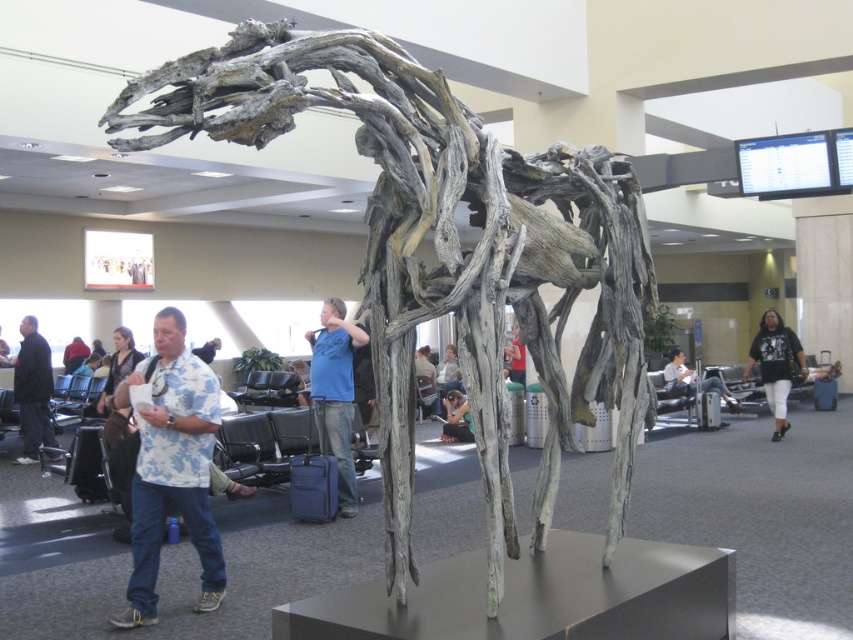
Question: Which object is positioned farthest from the black matte shirt at center?

Choices:
 (A) driftwood sculpture at center
 (B) dark gray fabric jacket at left
 (C) denim jeans at center
 (D) blue denim jeans at center

Answer: (B)

Question: Based on their relative distances, which object is nearer to the white floral shirt at center?

Choices:
 (A) black matte shirt at center
 (B) driftwood sculpture at center
 (C) dark gray fabric jacket at left
 (D) blue denim jeans at center

Answer: (D)

Question: Does black matte shirt at center appear over matte black camera at center?

Choices:
 (A) no
 (B) yes

Answer: (B)

Question: Is driftwood sculpture at center to the left of blue denim jeans at center from the viewer's perspective?

Choices:
 (A) yes
 (B) no

Answer: (B)

Question: Which of the following is the closest to the observer?

Choices:
 (A) white floral shirt at center
 (B) dark gray fabric jacket at left
 (C) blue denim jeans at center
 (D) matte gray sculpture at center

Answer: (A)

Question: Observing the image, what is the correct spatial positioning of blue denim jeans at center in reference to matte black camera at center?

Choices:
 (A) above
 (B) below

Answer: (A)